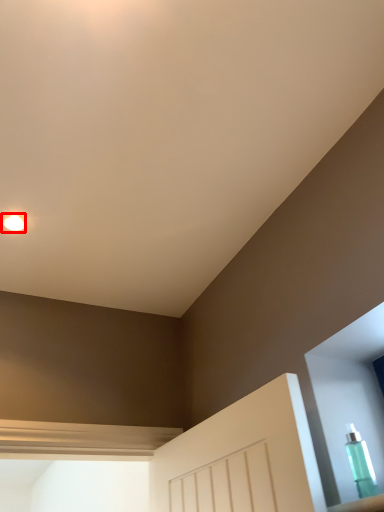
Question: From the image's perspective, considering the relative positions of droplight (annotated by the red box) and bottle in the image provided, where is droplight (annotated by the red box) located with respect to the staircase?

Choices:
 (A) above
 (B) below

Answer: (A)